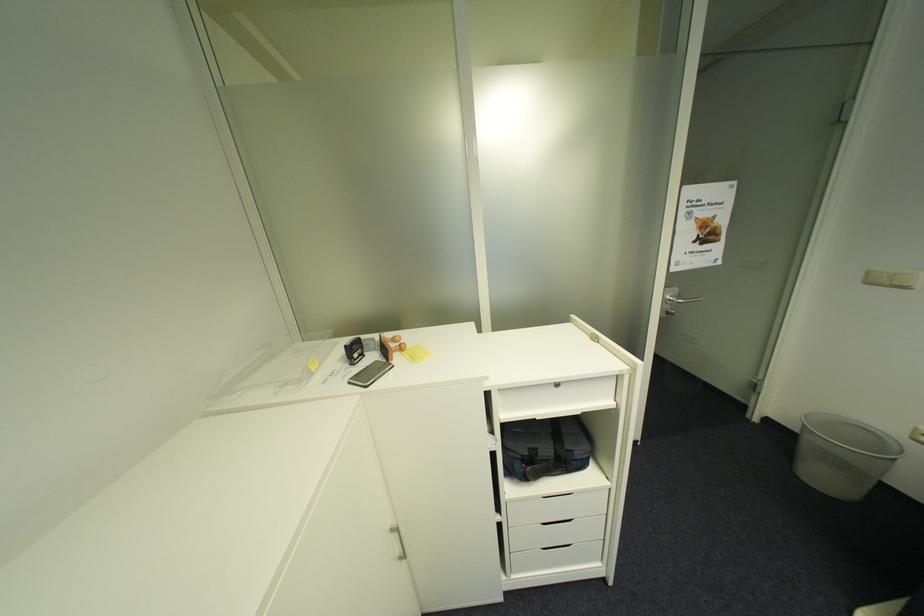
Find where to lift the grey trash bin. Please return your answer as a coordinate pair (x, y).

(842, 455)